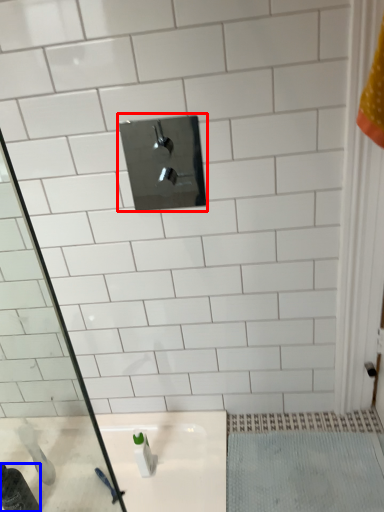
Question: Which of the following is the farthest to the observer, tap (highlighted by a red box) or bottle (highlighted by a blue box)?

Choices:
 (A) tap
 (B) bottle

Answer: (B)